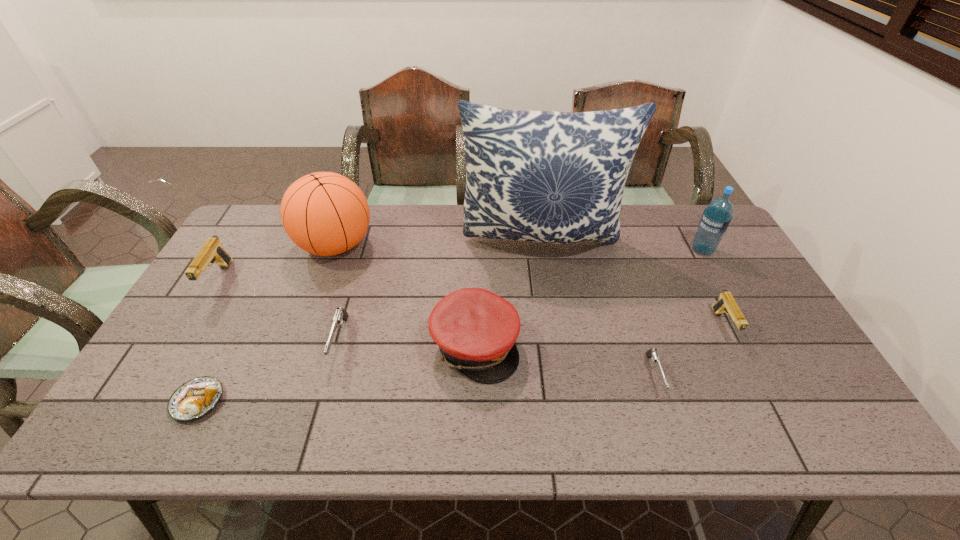
Locate an element on the screen. blue cushion is located at coordinates (x=554, y=177).

Find the location of `the tallest object`. the tallest object is located at coordinates (554, 177).

Identify the location of basketball. (324, 213).

Locate an element on the screen. water bottle is located at coordinates (716, 218).

The width and height of the screenshot is (960, 540). In order to click on blue water bottle in this screenshot , I will do `click(716, 218)`.

I want to click on the leftmost pistol, so click(212, 251).

Locate an element on the screen. The width and height of the screenshot is (960, 540). the farthest pistol is located at coordinates (212, 251).

Identify the location of red cap. This screenshot has width=960, height=540. (475, 329).

I want to click on the smaller tan pistol, so click(x=726, y=303).

This screenshot has height=540, width=960. I want to click on the right tan pistol, so click(x=726, y=303).